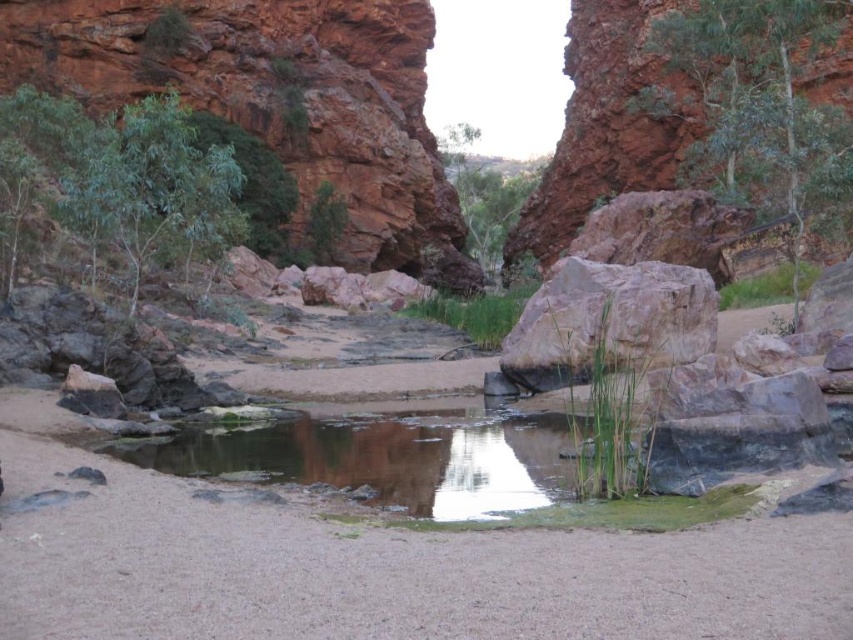
Consider the image. You are a hiker who wants to climb the highest object in the scene. Which object should you choose between the rustic sandstone cliff at upper left and the smooth beige rock at center?

The rustic sandstone cliff at upper left has a greater height compared to the smooth beige rock at center, so you should choose the rustic sandstone cliff at upper left for climbing.

You are standing at the center of the pool and want to climb up to the rustic sandstone cliff at upper left. Based on its position, is the cliff to your left or right side?

The rustic sandstone cliff at upper left is located at point (277, 99), which places it to the left side from your position at the center of the pool.